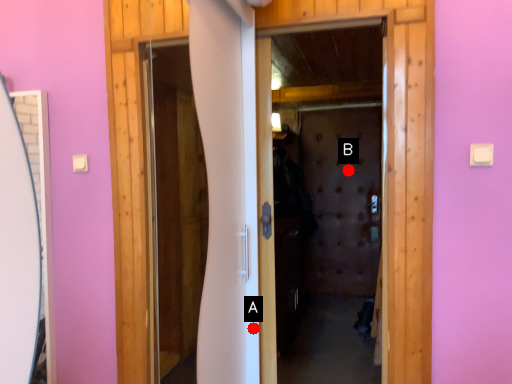
Question: Two points are circled on the image, labeled by A and B beside each circle. Which point appears farthest from the camera in this image?

Choices:
 (A) A is further
 (B) B is further

Answer: (B)